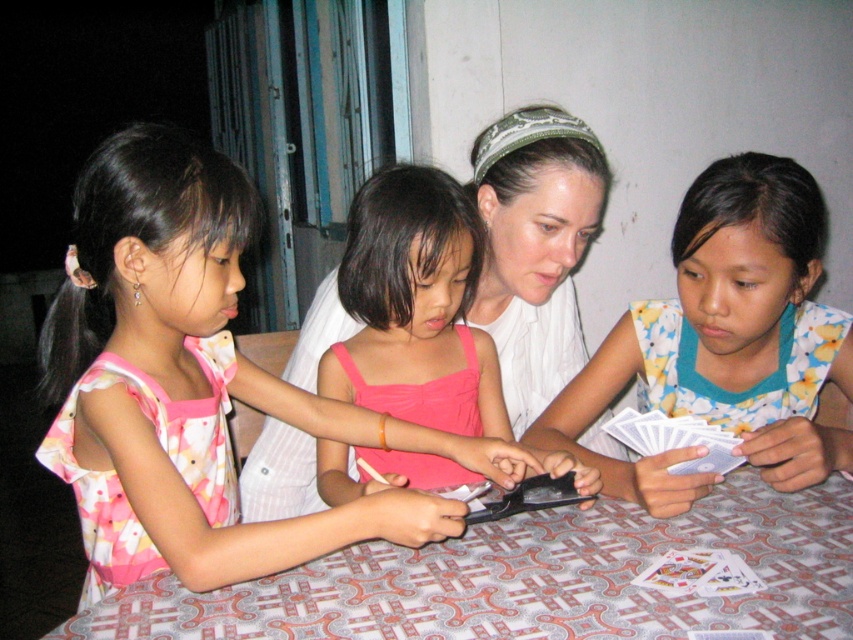
Question: Is white fabric at center positioned in front of pink satin dress at center?

Choices:
 (A) no
 (B) yes

Answer: (A)

Question: Which of the following is the closest to the observer?

Choices:
 (A) (709, 611)
 (B) (465, 376)

Answer: (A)

Question: Which point is farther to the camera?

Choices:
 (A) white paper cards at lower right
 (B) patterned fabric table at center
 (C) pink fabric dress at left

Answer: (A)

Question: Estimate the real-world distances between objects in this image. Which object is farther from the floral fabric shirt at center?

Choices:
 (A) white fabric at center
 (B) pink fabric dress at left

Answer: (B)

Question: Is patterned fabric table at center smaller than white paper cards at lower right?

Choices:
 (A) no
 (B) yes

Answer: (A)

Question: Does white fabric at center appear over pink satin dress at center?

Choices:
 (A) yes
 (B) no

Answer: (B)